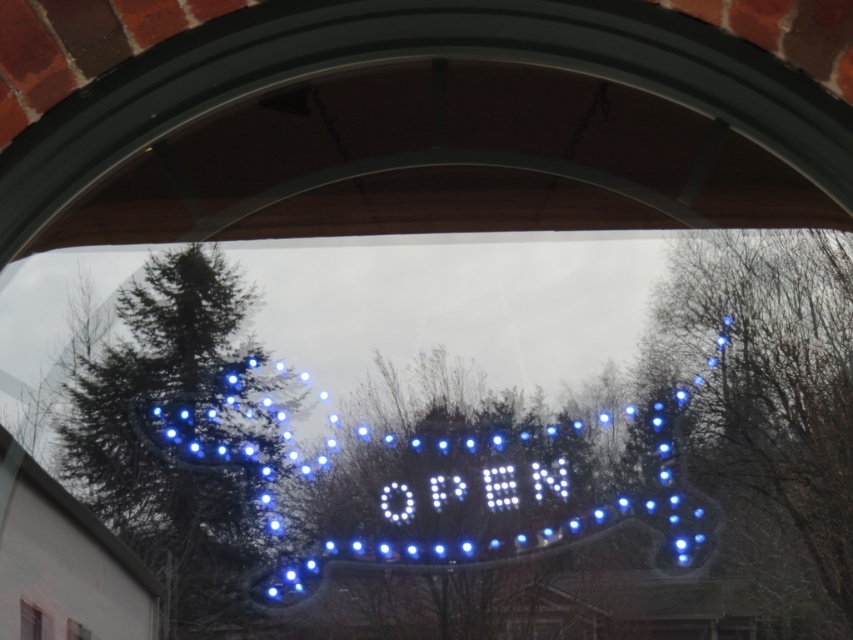
Question: Which object appears closest to the camera in this image?

Choices:
 (A) blue illuminated sign at center
 (B) transparent glass window at center

Answer: (A)

Question: From the image, what is the correct spatial relationship of blue illuminated sign at center in relation to transparent glass window at center?

Choices:
 (A) above
 (B) below

Answer: (A)

Question: Which object appears closest to the camera in this image?

Choices:
 (A) transparent glass window at center
 (B) blue illuminated sign at center

Answer: (B)

Question: Is blue illuminated sign at center wider than transparent glass window at center?

Choices:
 (A) no
 (B) yes

Answer: (B)

Question: Is blue illuminated sign at center wider than transparent glass window at center?

Choices:
 (A) no
 (B) yes

Answer: (B)